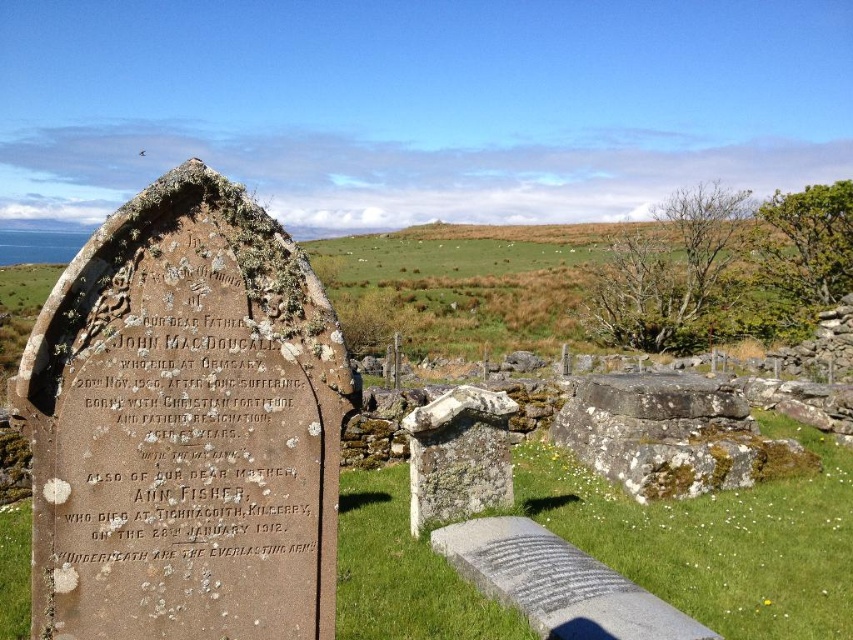
Is rusty stone tombstone at left to the right of green grass at center from the viewer's perspective?

In fact, rusty stone tombstone at left is to the left of green grass at center.

Is rusty stone tombstone at left wider than green grass at center?

No.

Between point (216, 301) and point (798, 596), which one is positioned behind?

The point (798, 596) is more distant.

This screenshot has height=640, width=853. I want to click on rusty stone tombstone at left, so click(x=184, y=426).

Does rusty stone tombstone at left appear under rough stone gravestone at center?

Incorrect, rusty stone tombstone at left is not positioned below rough stone gravestone at center.

Measure the distance from rusty stone tombstone at left to rough stone gravestone at center.

A distance of 3.57 meters exists between rusty stone tombstone at left and rough stone gravestone at center.

Is point (253, 392) positioned after point (409, 512)?

That is False.

This screenshot has height=640, width=853. I want to click on rusty stone tombstone at left, so click(184, 426).

Does green grass at center appear on the right side of rough stone gravestone at center?

Indeed, green grass at center is positioned on the right side of rough stone gravestone at center.

Between green grass at center and rough stone gravestone at center, which one appears on the left side from the viewer's perspective?

From the viewer's perspective, rough stone gravestone at center appears more on the left side.

Describe the element at coordinates (717, 540) in the screenshot. I see `green grass at center` at that location.

Locate an element on the screen. green grass at center is located at coordinates (717, 540).